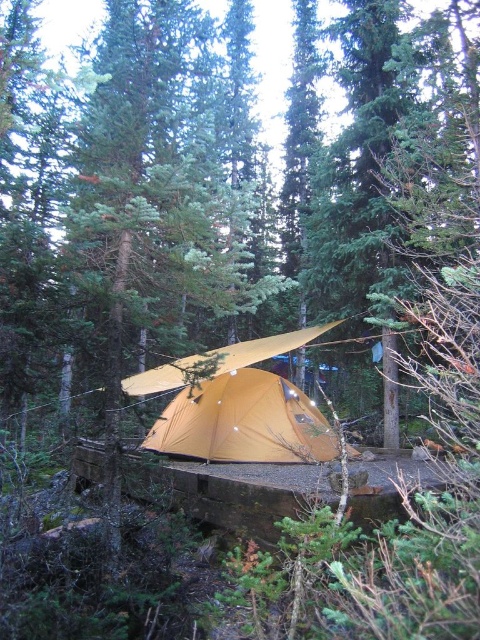
What do you see at coordinates (243, 422) in the screenshot? I see `matte yellow tent at center` at bounding box center [243, 422].

Is matte yellow tent at center above matte yellow tarp at center?

No, matte yellow tent at center is not above matte yellow tarp at center.

Is point (244, 410) in front of point (210, 352)?

Yes, point (244, 410) is closer to viewer.

Image resolution: width=480 pixels, height=640 pixels. In order to click on matte yellow tent at center in this screenshot , I will do `click(243, 422)`.